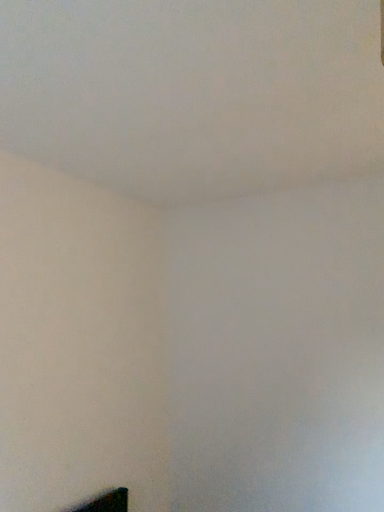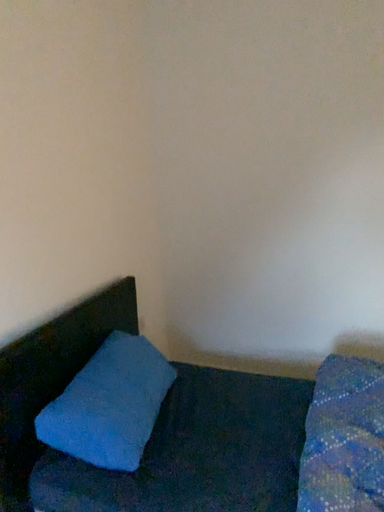
Question: How did the camera likely rotate when shooting the video?

Choices:
 (A) rotated upward
 (B) rotated downward

Answer: (B)